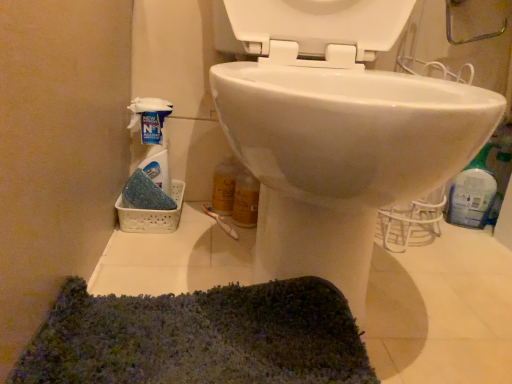
Locate an element on the screen. Image resolution: width=512 pixels, height=384 pixels. free location to the right of white plastic spray bottle at left, the first cleaning product positioned from the left is located at coordinates (212, 230).